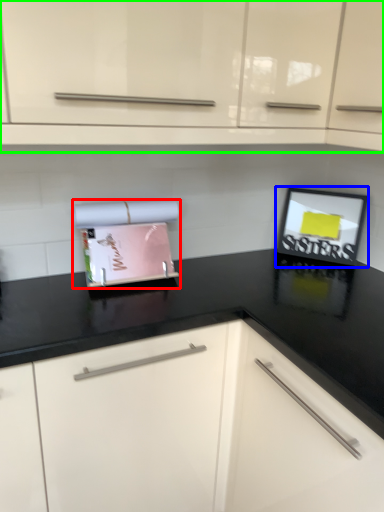
Question: Considering the real-world distances, which object is closest to appliance (highlighted by a red box)? picture frame (highlighted by a blue box) or cabinetry (highlighted by a green box).

Choices:
 (A) picture frame
 (B) cabinetry

Answer: (B)